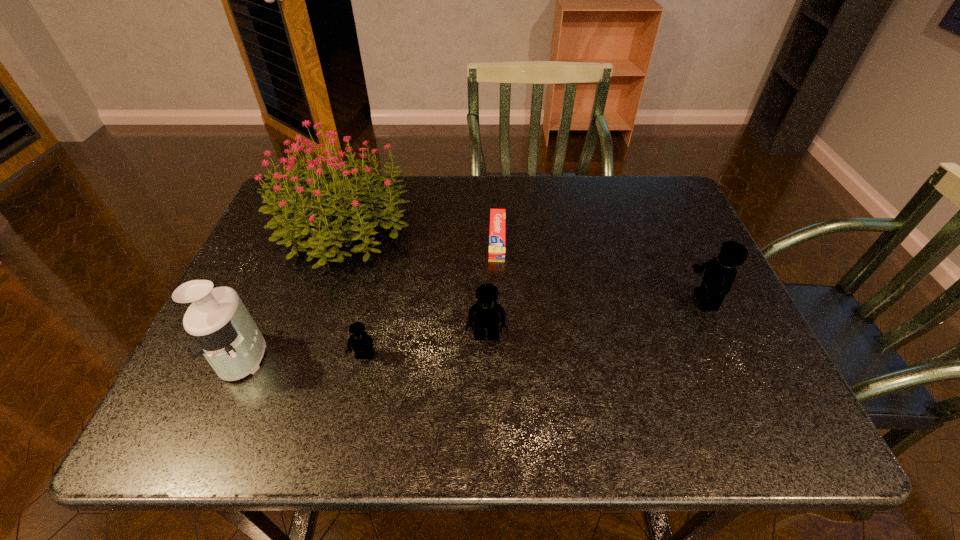
You are a GUI agent. You are given a task and a screenshot of the screen. Output one action in this format:
    pyautogui.click(x=<x>, y=<y>)
    Task: Click on the fifth tallest object
    Image resolution: width=960 pixels, height=540 pixels.
    Given the screenshot: What is the action you would take?
    pyautogui.click(x=362, y=344)

The height and width of the screenshot is (540, 960). I want to click on the shortest Lego, so click(x=362, y=344).

This screenshot has width=960, height=540. Identify the location of the second farthest Lego. (486, 314).

The width and height of the screenshot is (960, 540). What are the coordinates of `the second tallest Lego` in the screenshot? It's located at (486, 314).

Find the location of a particular element. This screenshot has height=540, width=960. the farthest Lego is located at coordinates (720, 272).

This screenshot has height=540, width=960. I want to click on the fourth nearest object, so click(x=720, y=272).

The width and height of the screenshot is (960, 540). In order to click on bouquet in this screenshot , I will do `click(298, 210)`.

Find the location of a particular element. toothpaste is located at coordinates (497, 216).

Where is `juicer`? juicer is located at coordinates (225, 333).

I want to click on vacant area situated 0.110m on the front-facing side of the second tallest Lego, so click(x=487, y=394).